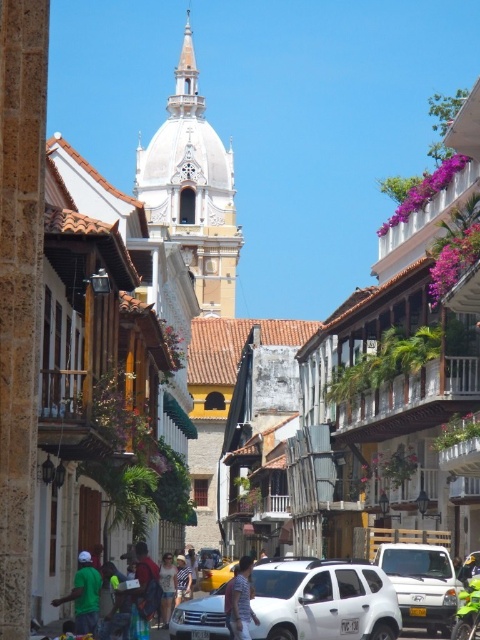
Question: Is light brown leather jacket at center positioned behind denim shorts at lower center?

Choices:
 (A) yes
 (B) no

Answer: (B)

Question: Which of the following is the closest to the observer?

Choices:
 (A) (231, 570)
 (B) (229, 589)
 (C) (182, 564)
 (D) (167, 561)

Answer: (B)

Question: Which of the following is the farthest from the observer?

Choices:
 (A) (436, 563)
 (B) (261, 589)

Answer: (A)

Question: Can you confirm if green matte shirt at lower left is positioned above denim shorts at lower center?

Choices:
 (A) no
 (B) yes

Answer: (B)

Question: Estimate the real-world distances between objects in this image. Which object is farther from the denim shorts at center?

Choices:
 (A) metallic silver car at center
 (B) white matte car at lower right

Answer: (A)

Question: Does light brown leather jacket at center have a larger size compared to denim shorts at lower center?

Choices:
 (A) yes
 (B) no

Answer: (B)